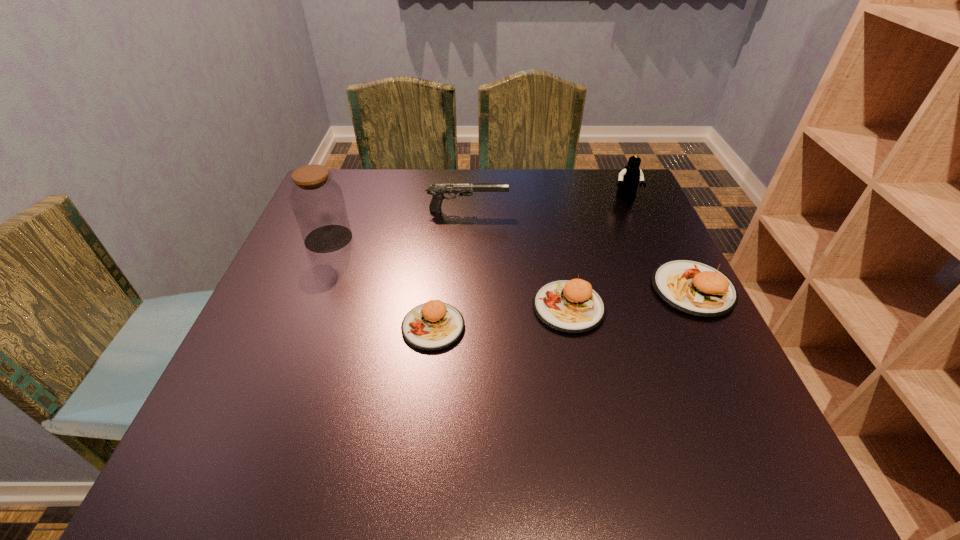
At what (x,y) coordinates should I click in order to perform the action: click on free space that satisfies the following two spatial constraints: 1. on the back side of the rightmost patty; 2. at the muzzle end of the second farthest object. Please return your answer as a coordinate pair (x, y). The width and height of the screenshot is (960, 540). Looking at the image, I should click on (653, 211).

You are a GUI agent. You are given a task and a screenshot of the screen. Output one action in this format:
    pyautogui.click(x=<x>, y=<y>)
    Task: Click on the free space that satisfies the following two spatial constraints: 1. at the muzzle end of the rightmost patty; 2. on the left side of the fifth nearest object
    The height and width of the screenshot is (540, 960).
    Given the screenshot: What is the action you would take?
    pyautogui.click(x=464, y=289)

The width and height of the screenshot is (960, 540). Find the location of `vacant space that satisfies the following two spatial constraints: 1. on the front-facing side of the Lego; 2. at the muzzle end of the gun`. vacant space that satisfies the following two spatial constraints: 1. on the front-facing side of the Lego; 2. at the muzzle end of the gun is located at coordinates (632, 211).

Where is `vacant region that satisfies the following two spatial constraints: 1. on the front-facing side of the Lego; 2. at the muzzle end of the second farthest object`? This screenshot has height=540, width=960. vacant region that satisfies the following two spatial constraints: 1. on the front-facing side of the Lego; 2. at the muzzle end of the second farthest object is located at coordinates (632, 211).